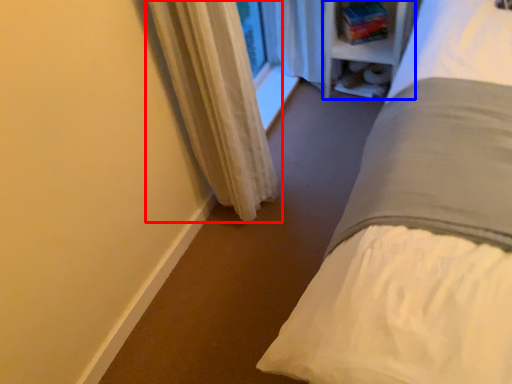
Question: Which of the following is the closest to the observer, curtain (highlighted by a red box) or bookshelf (highlighted by a blue box)?

Choices:
 (A) curtain
 (B) bookshelf

Answer: (A)